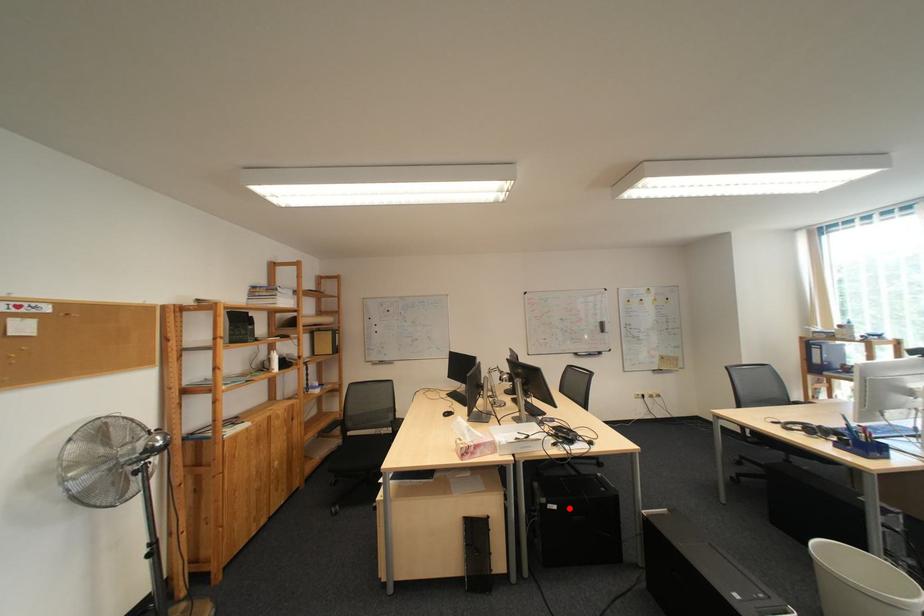
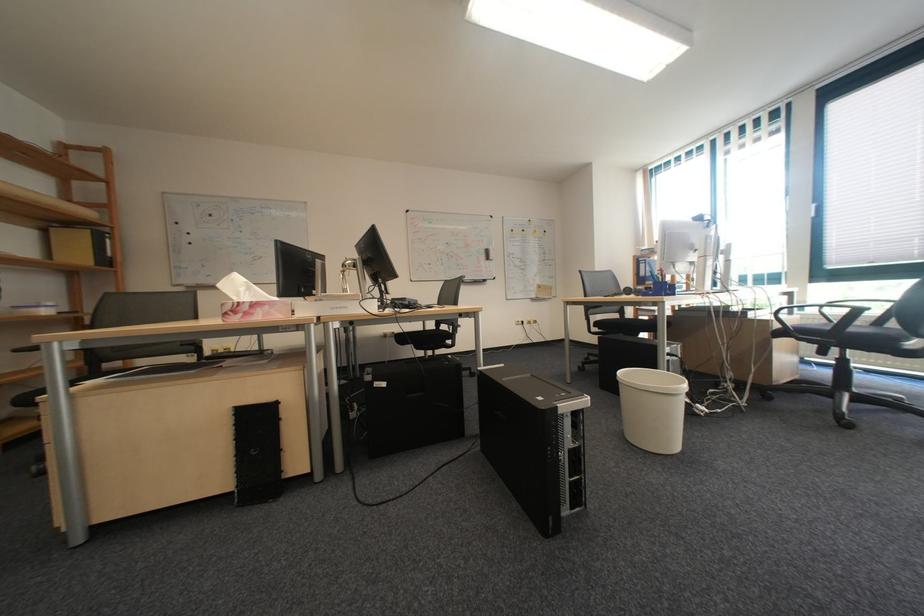
The point at the highlighted location is marked in the first image. Where is the corresponding point in the second image?

(398, 386)